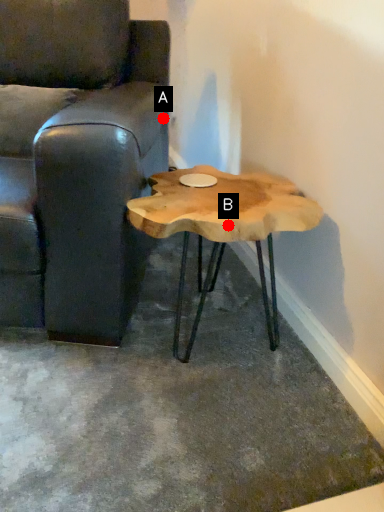
Question: Two points are circled on the image, labeled by A and B beside each circle. Which point is further to the camera?

Choices:
 (A) A is further
 (B) B is further

Answer: (A)